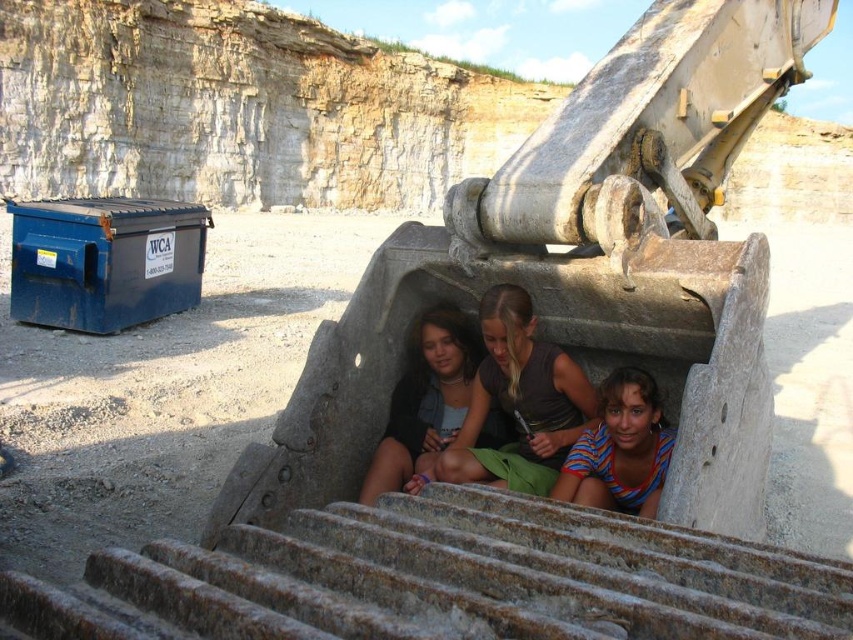
Question: Which of the following is the closest to the observer?

Choices:
 (A) striped fabric shirt at center
 (B) matte black shirt at center
 (C) striped cotton shirt at lower center
 (D) rusty metal stairs at lower center

Answer: (D)

Question: Is the position of rusty metal stairs at lower center more distant than that of matte black shirt at center?

Choices:
 (A) no
 (B) yes

Answer: (A)

Question: Does striped fabric shirt at center lie in front of striped cotton shirt at lower center?

Choices:
 (A) yes
 (B) no

Answer: (B)

Question: From the image, what is the correct spatial relationship of rusty metal stairs at lower center in relation to matte black shirt at center?

Choices:
 (A) right
 (B) left

Answer: (B)

Question: Which object is the closest to the rusty metal stairs at lower center?

Choices:
 (A) striped fabric shirt at center
 (B) matte black shirt at center
 (C) striped cotton shirt at lower center

Answer: (C)

Question: Which object appears closest to the camera in this image?

Choices:
 (A) striped fabric shirt at center
 (B) matte black shirt at center
 (C) rusty metal stairs at lower center
 (D) striped cotton shirt at lower center

Answer: (C)